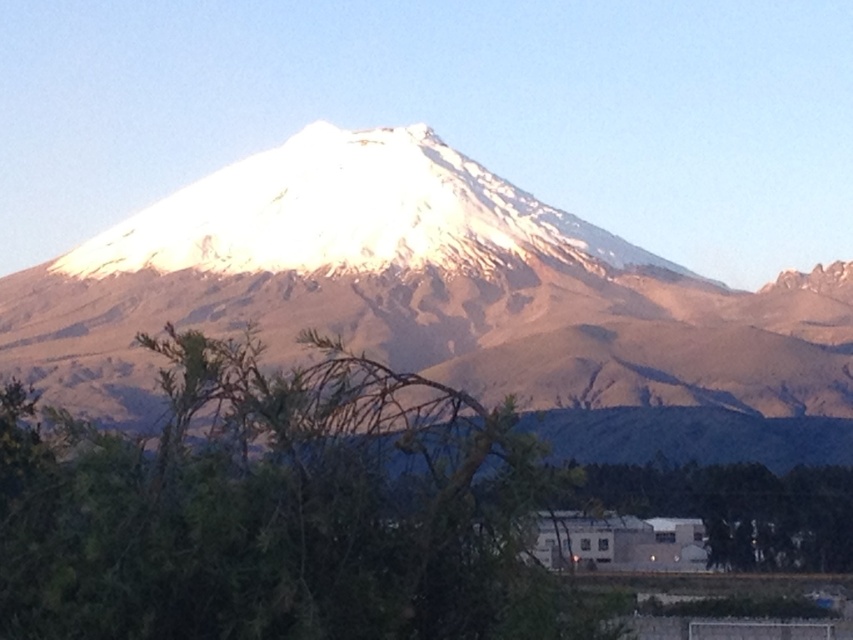
Can you confirm if white snow-covered mountain at center is wider than green leafy tree at lower left?

Indeed, white snow-covered mountain at center has a greater width compared to green leafy tree at lower left.

Does point (395, 260) come farther from viewer compared to point (318, 397)?

Yes, it is.

In order to click on white snow-covered mountain at center in this screenshot , I will do `click(445, 305)`.

What are the coordinates of `white snow-covered mountain at center` in the screenshot? It's located at (445, 305).